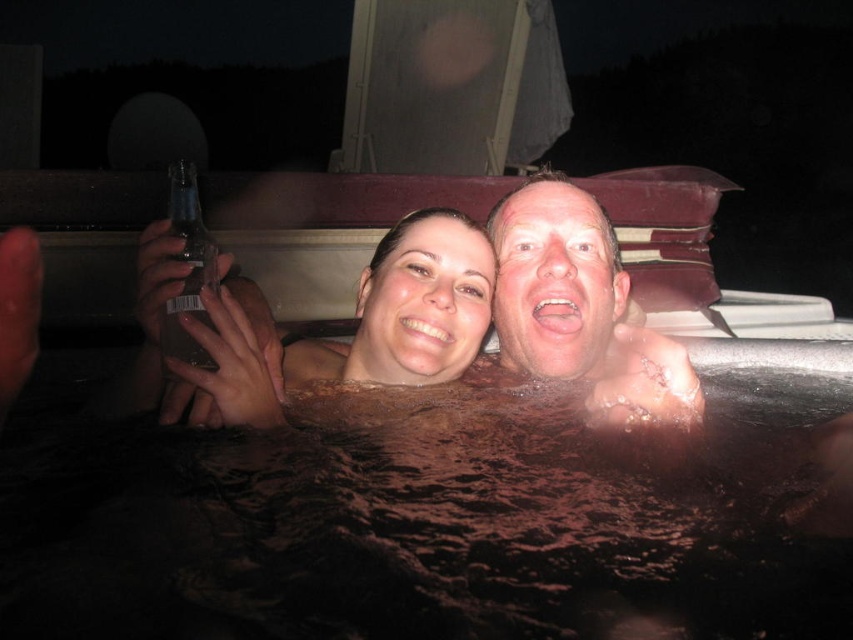
You are a photographer trying to capture the perfect shot of the smooth skin couple at center and the smooth skin face at center in the hot tub. Which one should you focus on first if you want to ensure both are in sharp focus?

The smooth skin couple at center should be focused on first because it is positioned below the smooth skin face at center, so focusing on the lower subject first will help ensure both are in sharp focus.